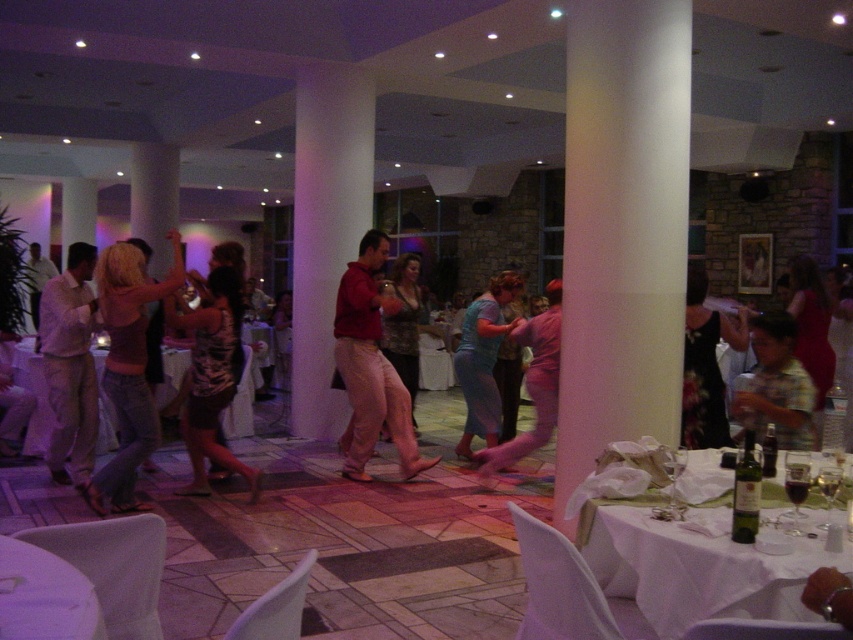
You are standing at the entrance of the hall and want to reach a specific point marked as point [653,26]. Can you estimate how far you need to walk to reach this point?

The distance of point [653,26] from viewer is 4.39 meters, so you need to walk approximately 4.39 meters to reach it.